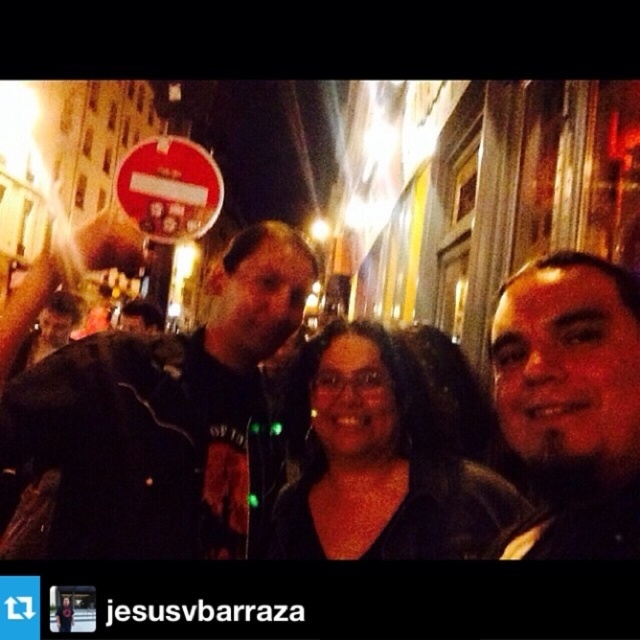
You are a photographer trying to adjust the focus of your camera. You want to ensure both the black leather jacket at left and the black matte glasses at center are in focus. The camera has a depth of field that can cover 35 inches. Can both objects be in focus at the same time?

The black leather jacket at left is 30.90 inches from black matte glasses at center. Since the distance between them is less than the camera depth of field of 35 inches, both objects can be in focus simultaneously.

You are a photographer trying to adjust the focus of your camera to capture the dark brown leather jacket at right. What are the coordinates where you should focus?

The dark brown leather jacket at right is located at point (572, 403), so you should focus your camera at those coordinates to capture it clearly.

You are standing at the point marked as point (234, 429) in the image. You want to take a photo of the three people in the scene. Can you estimate whether you are close enough to capture all three individuals in a single frame without zooming?

Result: The distance of point (234, 429) from viewer is 3.95 meters. Since the three people are positioned closely together, you are likely close enough to capture them in a single frame without zooming.